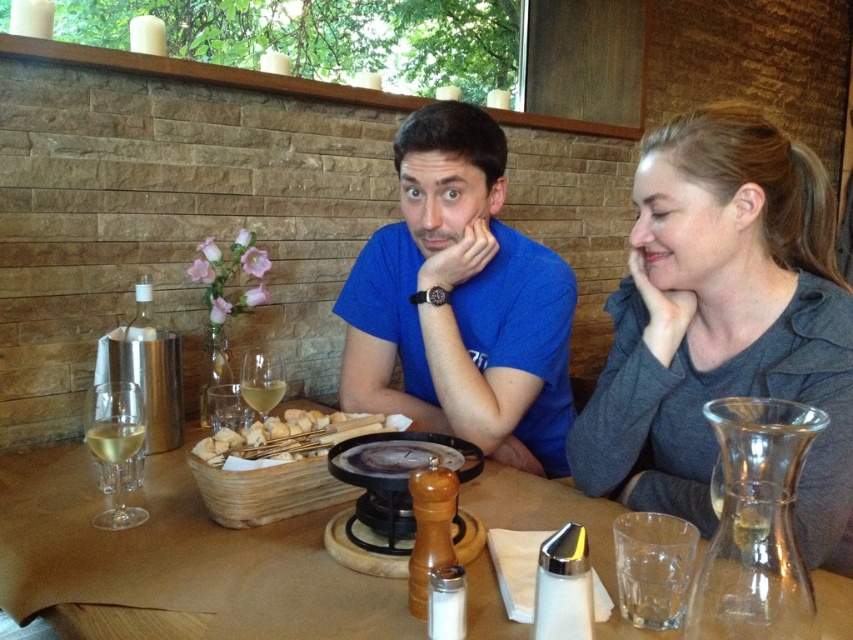
Question: Is clear glass wine glass at lower left to the left of clear glass wine glass at center from the viewer's perspective?

Choices:
 (A) no
 (B) yes

Answer: (B)

Question: Which of the following is the farthest from the observer?

Choices:
 (A) translucent glass wine at table left
 (B) blue cotton shirt at center

Answer: (B)

Question: Among these points, which one is farthest from the camera?

Choices:
 (A) (753, 172)
 (B) (115, 417)
 (C) (529, 451)

Answer: (C)

Question: Is gray cotton shirt at upper right to the left of translucent glass wine at center from the viewer's perspective?

Choices:
 (A) yes
 (B) no

Answer: (B)

Question: Estimate the real-world distances between objects in this image. Which object is farther from the wooden table at center?

Choices:
 (A) clear glass wine glass at center
 (B) breadsticks at center

Answer: (A)

Question: Can you confirm if gray cotton shirt at upper right is smaller than breadsticks at center?

Choices:
 (A) no
 (B) yes

Answer: (A)